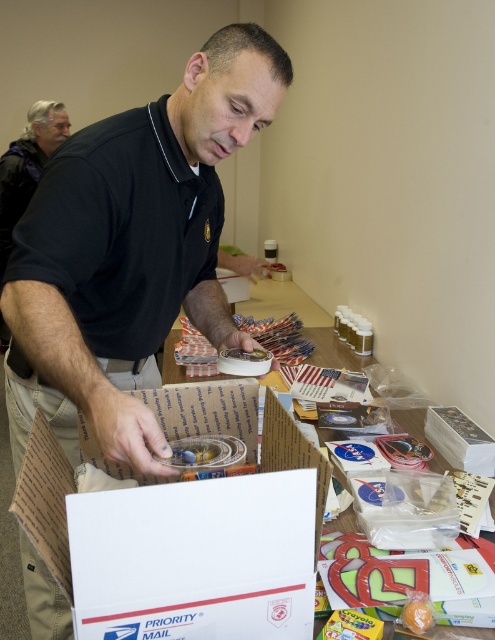
Which is below, black matte shirt at center or white cardboard box at center?

white cardboard box at center is lower down.

What do you see at coordinates (131, 250) in the screenshot? I see `black matte shirt at center` at bounding box center [131, 250].

This screenshot has width=495, height=640. Describe the element at coordinates (131, 250) in the screenshot. I see `black matte shirt at center` at that location.

Image resolution: width=495 pixels, height=640 pixels. Identify the location of black matte shirt at center. (131, 250).

Which is more to the left, black matte shirt at center or orange matte/soft orange at lower right?

black matte shirt at center is more to the left.

Between black matte shirt at center and orange matte/soft orange at lower right, which one is positioned lower?

orange matte/soft orange at lower right

Where is `black matte shirt at center`? black matte shirt at center is located at coordinates (131, 250).

Consider the image. Is white cardboard box at center shorter than orange matte/soft orange at lower right?

No, white cardboard box at center is not shorter than orange matte/soft orange at lower right.

Is white cardboard box at center bigger than orange matte/soft orange at lower right?

Correct, white cardboard box at center is larger in size than orange matte/soft orange at lower right.

Does point (265, 417) lie in front of point (407, 624)?

No, (265, 417) is behind (407, 624).

Locate an element on the screen. This screenshot has height=640, width=495. white cardboard box at center is located at coordinates (283, 497).